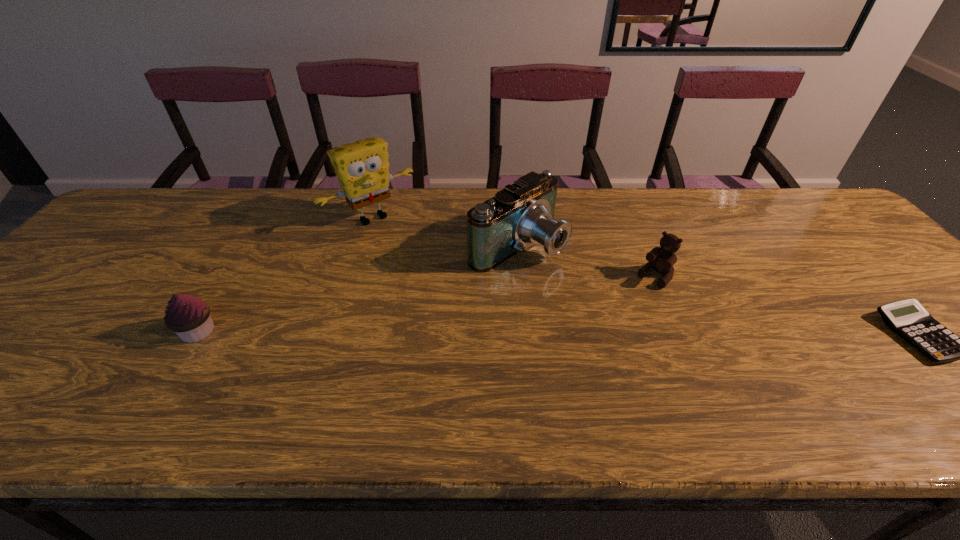
Locate an element on the screen. vacant space on the desktop that is between the cupcake and the rightmost object and is positioned on the face of the teddy bear is located at coordinates (599, 333).

Where is `free space on the desktop that is between the cupcake and the shortest object and is positioned on the face of the fourth object from right to left`? The width and height of the screenshot is (960, 540). free space on the desktop that is between the cupcake and the shortest object and is positioned on the face of the fourth object from right to left is located at coordinates (478, 333).

The height and width of the screenshot is (540, 960). In order to click on free space on the desktop that is between the leftmost object and the shortest object and is positioned on the front-facing side of the second tallest object in this screenshot , I will do `click(660, 333)`.